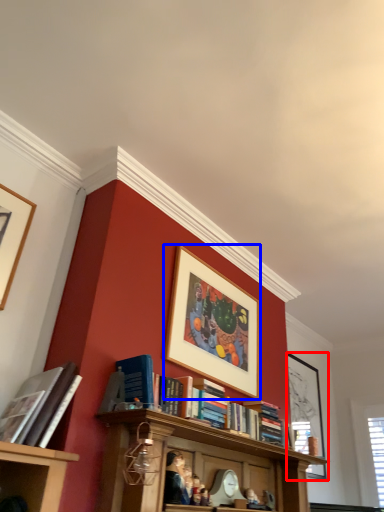
Question: Which object appears closest to the camera in this image, picture frame (highlighted by a red box) or picture frame (highlighted by a blue box)?

Choices:
 (A) picture frame
 (B) picture frame

Answer: (B)